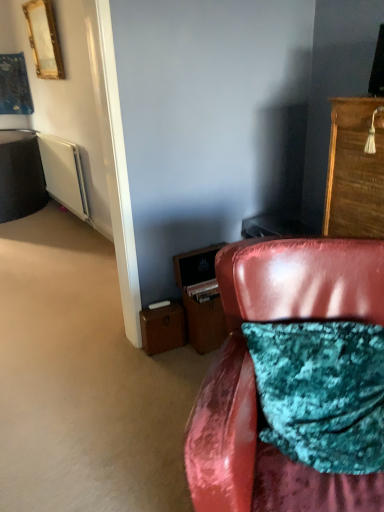
Question: Considering the relative sizes of wooden drawer at lower center, which is counted as the second drawer, starting from the left, and brown leather suitcase at lower left, which ranks as the 1th drawer in left-to-right order, in the image provided, is wooden drawer at lower center, which is counted as the second drawer, starting from the left, bigger than brown leather suitcase at lower left, which ranks as the 1th drawer in left-to-right order,?

Choices:
 (A) yes
 (B) no

Answer: (A)

Question: Is wooden drawer at lower center, marked as the 1th drawer in a right-to-left arrangement, thinner than brown leather suitcase at lower left, which ranks as the 1th drawer in left-to-right order?

Choices:
 (A) no
 (B) yes

Answer: (A)

Question: Does wooden drawer at lower center, which is counted as the second drawer, starting from the left, have a greater height compared to brown leather suitcase at lower left, acting as the 2th drawer starting from the right?

Choices:
 (A) yes
 (B) no

Answer: (A)

Question: Is wooden drawer at lower center, which is counted as the second drawer, starting from the left, aimed at brown leather suitcase at lower left, which ranks as the 1th drawer in left-to-right order?

Choices:
 (A) yes
 (B) no

Answer: (B)

Question: Would you say wooden drawer at lower center, marked as the 1th drawer in a right-to-left arrangement, is a long distance from brown leather suitcase at lower left, which ranks as the 1th drawer in left-to-right order?

Choices:
 (A) no
 (B) yes

Answer: (A)

Question: From the image's perspective, is gold-framed mirror at upper left located above or below brown leather suitcase at lower left, acting as the 2th drawer starting from the right?

Choices:
 (A) above
 (B) below

Answer: (A)

Question: Is gold-framed mirror at upper left bigger or smaller than brown leather suitcase at lower left, which ranks as the 1th drawer in left-to-right order?

Choices:
 (A) big
 (B) small

Answer: (A)

Question: Considering the positions of gold-framed mirror at upper left and brown leather suitcase at lower left, which ranks as the 1th drawer in left-to-right order, in the image, is gold-framed mirror at upper left taller or shorter than brown leather suitcase at lower left, which ranks as the 1th drawer in left-to-right order,?

Choices:
 (A) tall
 (B) short

Answer: (A)

Question: Relative to brown leather suitcase at lower left, acting as the 2th drawer starting from the right, is gold-framed mirror at upper left in front or behind?

Choices:
 (A) front
 (B) behind

Answer: (B)

Question: Is point (155, 304) closer or farther from the camera than point (87, 212)?

Choices:
 (A) farther
 (B) closer

Answer: (B)

Question: Is brown leather suitcase at lower left, which ranks as the 1th drawer in left-to-right order, to the left or to the right of white matte radiator at left in the image?

Choices:
 (A) left
 (B) right

Answer: (B)

Question: Is brown leather suitcase at lower left, acting as the 2th drawer starting from the right, bigger or smaller than white matte radiator at left?

Choices:
 (A) big
 (B) small

Answer: (B)

Question: From their relative heights in the image, would you say brown leather suitcase at lower left, acting as the 2th drawer starting from the right, is taller or shorter than white matte radiator at left?

Choices:
 (A) tall
 (B) short

Answer: (B)

Question: Is gold-framed mirror at upper left taller or shorter than brown leather file cabinet at lower center?

Choices:
 (A) tall
 (B) short

Answer: (A)

Question: Considering their positions, is gold-framed mirror at upper left located in front of or behind brown leather file cabinet at lower center?

Choices:
 (A) front
 (B) behind

Answer: (B)